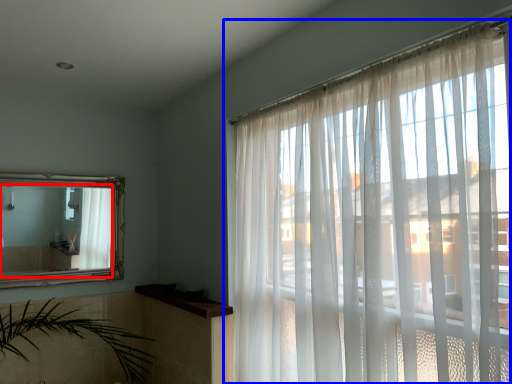
Question: Which object is closer to the camera taking this photo, mirror (highlighted by a red box) or window (highlighted by a blue box)?

Choices:
 (A) mirror
 (B) window

Answer: (B)